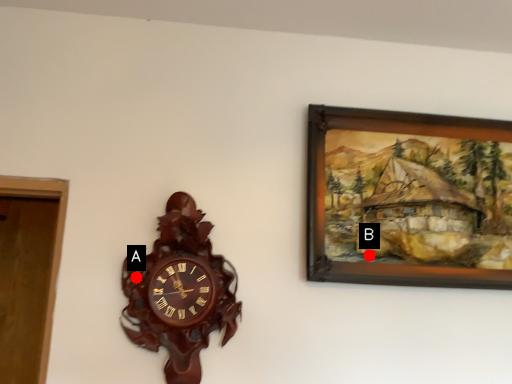
Question: Two points are circled on the image, labeled by A and B beside each circle. Which point is closer to the camera?

Choices:
 (A) A is closer
 (B) B is closer

Answer: (A)